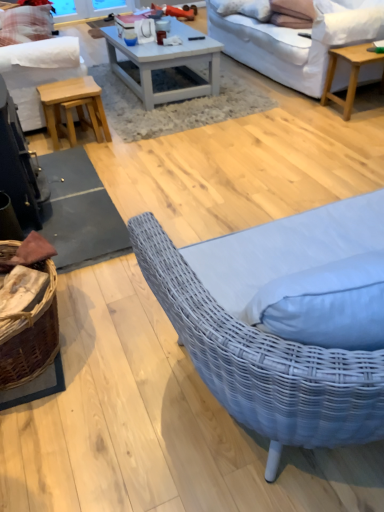
Question: From the image's perspective, would you say white painted wood coffee table at center, the first coffee table in the left-to-right sequence, is shown under light brown wooden stool at left?

Choices:
 (A) yes
 (B) no

Answer: (B)

Question: Is white painted wood coffee table at center, the 2th coffee table positioned from the right, at the right side of light brown wooden stool at left?

Choices:
 (A) no
 (B) yes

Answer: (B)

Question: Is white painted wood coffee table at center, the 2th coffee table positioned from the right, oriented towards light brown wooden stool at left?

Choices:
 (A) yes
 (B) no

Answer: (B)

Question: Does white painted wood coffee table at center, the 2th coffee table positioned from the right, lie behind light brown wooden stool at left?

Choices:
 (A) yes
 (B) no

Answer: (A)

Question: From a real-world perspective, is white painted wood coffee table at center, the first coffee table in the left-to-right sequence, located beneath light brown wooden stool at left?

Choices:
 (A) no
 (B) yes

Answer: (A)

Question: From the image's perspective, relative to white fabric studio couch at left, which is counted as the first studio couch, starting from the left, is suede-like beige pillow at upper right, which is the 1th pillow in front-to-back order, above or below?

Choices:
 (A) above
 (B) below

Answer: (A)

Question: Does point (299, 2) appear closer or farther from the camera than point (0, 69)?

Choices:
 (A) farther
 (B) closer

Answer: (A)

Question: From a real-world perspective, is suede-like beige pillow at upper right, which is the 1th pillow in front-to-back order, positioned above or below white fabric studio couch at left, which is counted as the first studio couch, starting from the left?

Choices:
 (A) below
 (B) above

Answer: (B)

Question: Choose the correct answer: Is suede-like beige pillow at upper right, placed as the first pillow when sorted from bottom to top, inside white fabric studio couch at left, placed as the 2th studio couch when sorted from right to left, or outside it?

Choices:
 (A) outside
 (B) inside

Answer: (A)

Question: From the image's perspective, is light brown wooden stool at left located above or below white painted wood coffee table at center, the 2th coffee table positioned from the right?

Choices:
 (A) above
 (B) below

Answer: (B)

Question: Choose the correct answer: Is light brown wooden stool at left inside white painted wood coffee table at center, the first coffee table in the left-to-right sequence, or outside it?

Choices:
 (A) inside
 (B) outside

Answer: (B)

Question: From a real-world perspective, is light brown wooden stool at left above or below white painted wood coffee table at center, the 2th coffee table positioned from the right?

Choices:
 (A) below
 (B) above

Answer: (A)

Question: Visually, is light brown wooden stool at left positioned to the left or to the right of white painted wood coffee table at center, the first coffee table in the left-to-right sequence?

Choices:
 (A) left
 (B) right

Answer: (A)

Question: Considering the positions of white fabric studio couch at upper right, the 1th studio couch when ordered from right to left, and light brown wooden stool at left in the image, is white fabric studio couch at upper right, the 1th studio couch when ordered from right to left, taller or shorter than light brown wooden stool at left?

Choices:
 (A) short
 (B) tall

Answer: (B)

Question: From the image's perspective, is white fabric studio couch at upper right, the 1th studio couch when ordered from right to left, positioned above or below light brown wooden stool at left?

Choices:
 (A) below
 (B) above

Answer: (B)